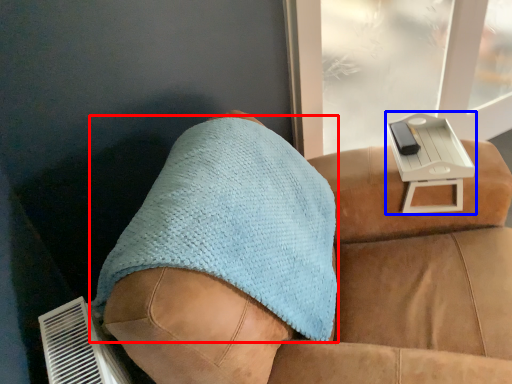
Question: Which of the following is the closest to the observer, throw pillow (highlighted by a red box) or table (highlighted by a blue box)?

Choices:
 (A) throw pillow
 (B) table

Answer: (A)